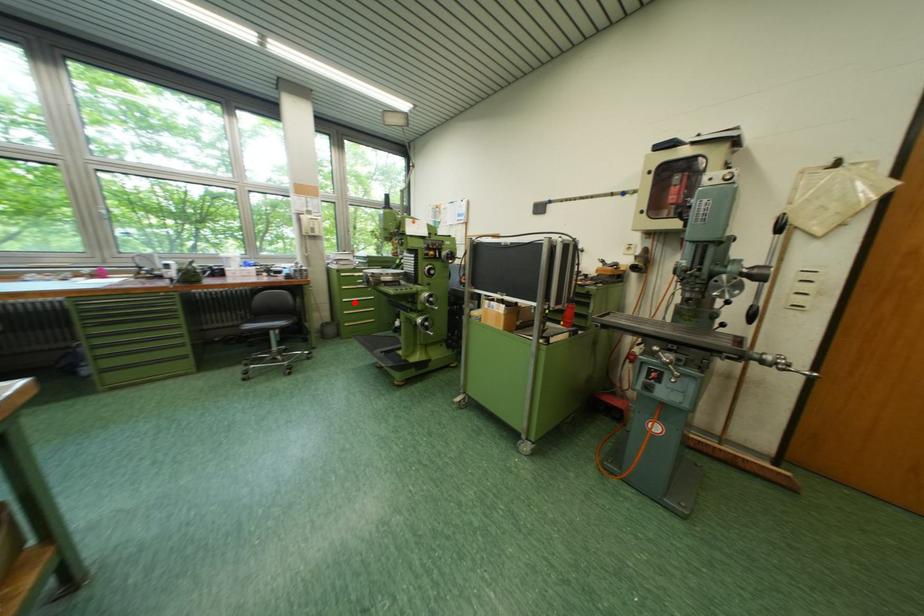
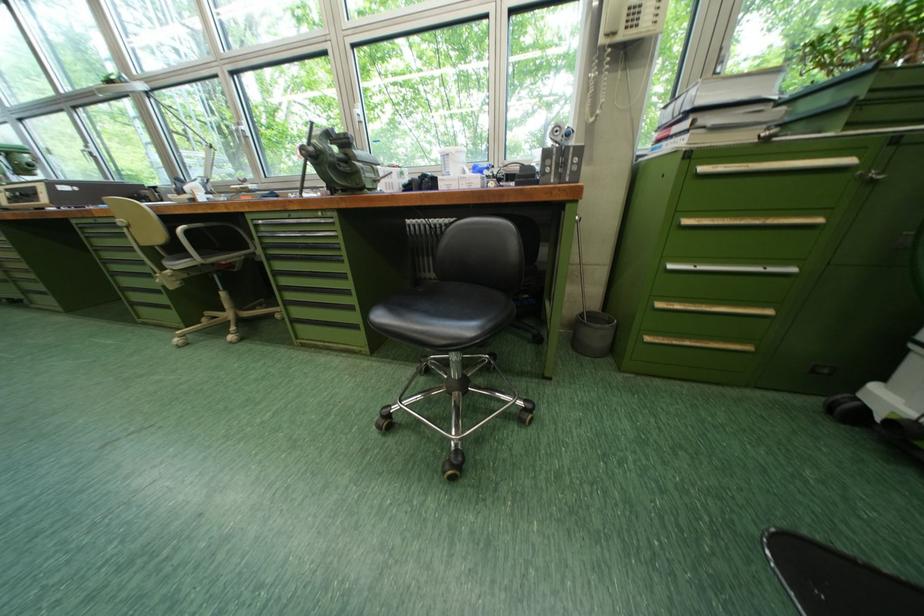
The point at the highlighted location is marked in the first image. Where is the corresponding point in the second image?

(681, 269)